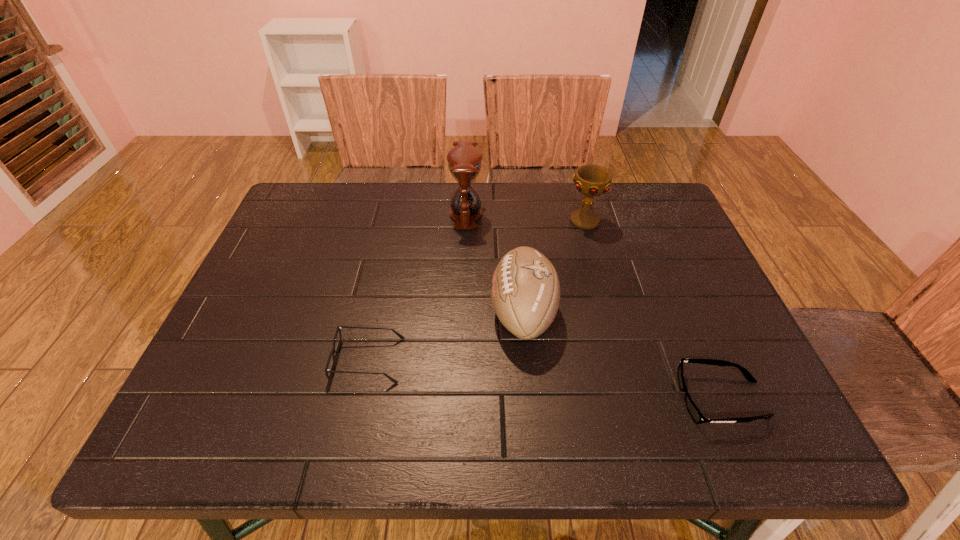
Find the location of a particular element. The image size is (960, 540). blank area at the far edge is located at coordinates (577, 200).

Identify the location of vacant region at the near edge. Image resolution: width=960 pixels, height=540 pixels. (662, 438).

Identify the location of vacant space at the left edge of the desktop. (268, 264).

Locate an element on the screen. Image resolution: width=960 pixels, height=540 pixels. vacant space at the right edge of the desktop is located at coordinates (702, 268).

I want to click on vacant point at the far left corner, so click(293, 210).

In the image, there is a desktop. Where is `free space at the far right corner`? Image resolution: width=960 pixels, height=540 pixels. free space at the far right corner is located at coordinates (627, 197).

You are a GUI agent. You are given a task and a screenshot of the screen. Output one action in this format:
    pyautogui.click(x=<x>, y=<y>)
    Task: Click on the free area in between the third object from right to left and the second object from left to right
    
    Given the screenshot: What is the action you would take?
    pyautogui.click(x=494, y=263)

The image size is (960, 540). What are the coordinates of `empty space that is in between the rightmost object and the leftmost object` in the screenshot? It's located at (545, 380).

Locate an element on the screen. Image resolution: width=960 pixels, height=540 pixels. free point between the sunglasses and the third object from right to left is located at coordinates (622, 356).

This screenshot has width=960, height=540. What are the coordinates of `vacant region between the hourglass and the rightmost object` in the screenshot? It's located at (593, 306).